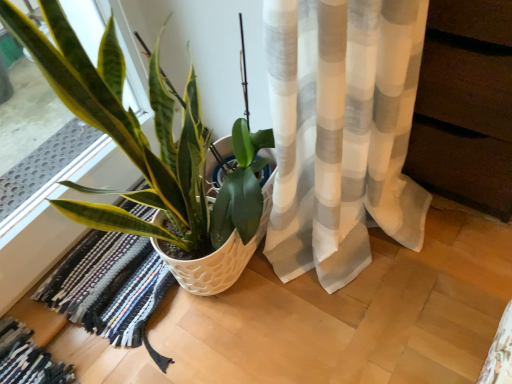
Question: In terms of width, does white textured pot at lower left look wider or thinner when compared to rug with frayed edges at lower left?

Choices:
 (A) thin
 (B) wide

Answer: (A)

Question: Based on their sizes in the image, would you say white textured pot at lower left is bigger or smaller than rug with frayed edges at lower left?

Choices:
 (A) small
 (B) big

Answer: (B)

Question: From a real-world perspective, relative to rug with frayed edges at lower left, is white textured pot at lower left vertically above or below?

Choices:
 (A) above
 (B) below

Answer: (A)

Question: Choose the correct answer: Is rug with frayed edges at lower left inside white textured pot at lower left or outside it?

Choices:
 (A) inside
 (B) outside

Answer: (A)

Question: Visually, is rug with frayed edges at lower left positioned to the left or to the right of white textured pot at lower left?

Choices:
 (A) right
 (B) left

Answer: (B)

Question: In the image, is rug with frayed edges at lower left positioned in front of or behind white textured pot at lower left?

Choices:
 (A) behind
 (B) front

Answer: (A)

Question: Is point (169, 276) closer or farther from the camera than point (163, 203)?

Choices:
 (A) closer
 (B) farther

Answer: (B)